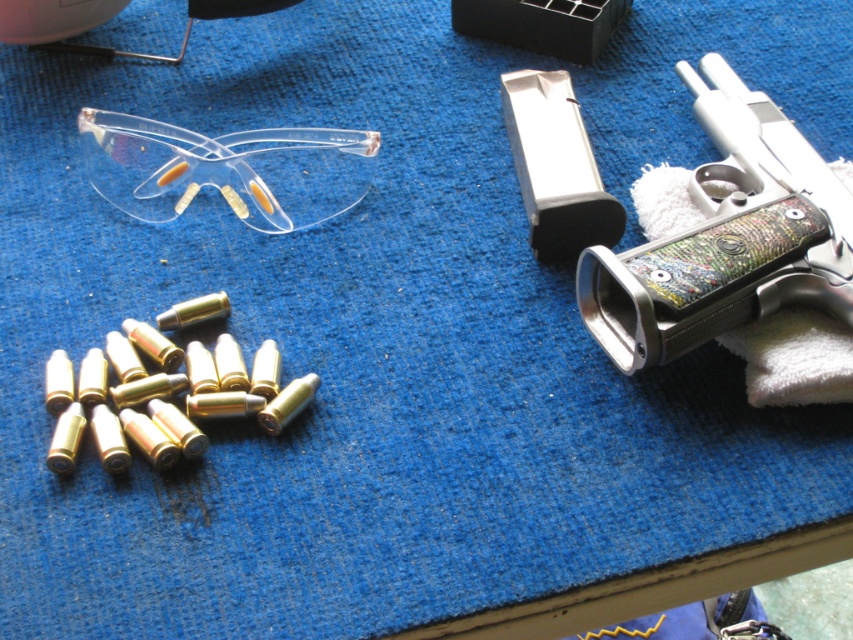
You are a collector organizing items on a shelf. You have the polished silver revolver at right and the transparent plastic goggles at upper left. Which item should you place higher on the shelf to ensure they don t touch each other?

The polished silver revolver at right is much taller than the transparent plastic goggles at upper left, so you should place the polished silver revolver at right higher on the shelf to prevent them from touching.